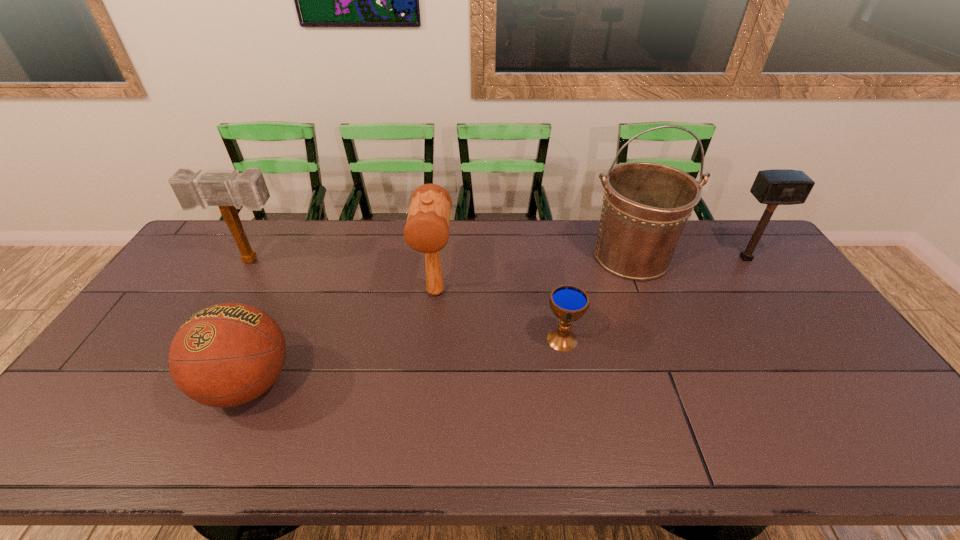
This screenshot has height=540, width=960. Find the location of `vacant position located on the strike surface of the second mallet from right to left`. vacant position located on the strike surface of the second mallet from right to left is located at coordinates (430, 346).

Identify the location of vacant area situated on the front of the leftmost mallet. The width and height of the screenshot is (960, 540). (207, 338).

Where is `vacant space located 0.150m on the back of the rightmost mallet`? The height and width of the screenshot is (540, 960). vacant space located 0.150m on the back of the rightmost mallet is located at coordinates (723, 226).

Identify the location of vacant space located on the right of the basketball. (319, 384).

Where is `vacant region located 0.170m on the front of the chalice`? The image size is (960, 540). vacant region located 0.170m on the front of the chalice is located at coordinates (575, 410).

Locate an element on the screen. bucket situated at the far edge is located at coordinates (646, 205).

Find the location of `object at the near edge`. object at the near edge is located at coordinates (228, 354).

I want to click on object present at the left edge, so click(229, 191).

Image resolution: width=960 pixels, height=540 pixels. What are the coordinates of `object at the right edge` in the screenshot? It's located at (774, 187).

Locate an element on the screen. The height and width of the screenshot is (540, 960). object present at the far left corner is located at coordinates (229, 191).